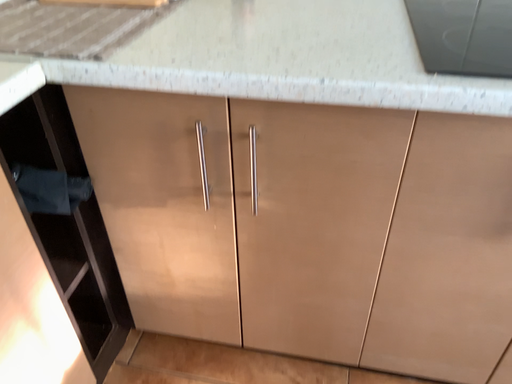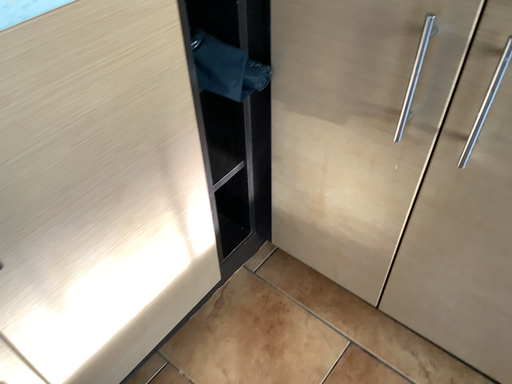
Question: How did the camera likely rotate when shooting the video?

Choices:
 (A) rotated downward
 (B) rotated upward

Answer: (A)